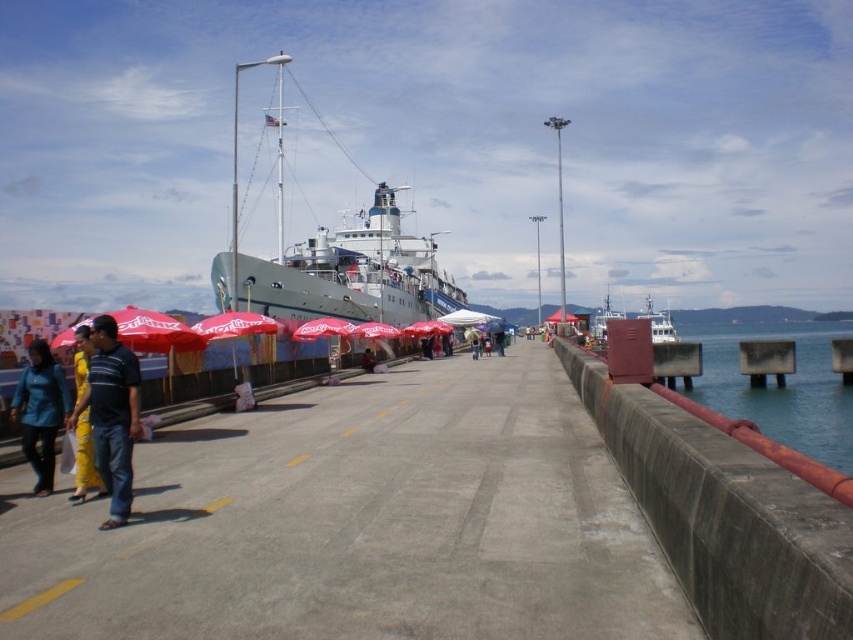
Does silver metallic ship at center have a lesser height compared to red fabric umbrella at center?

Incorrect, silver metallic ship at center's height does not fall short of red fabric umbrella at center's.

Who is more distant from viewer, [332,253] or [366,349]?

The point [332,253] is behind.

Where is `silver metallic ship at center`? This screenshot has width=853, height=640. silver metallic ship at center is located at coordinates (334, 257).

Who is more distant from viewer, (137, 392) or (363, 364)?

Point (363, 364)

Does striped fabric shirt at center appear under red fabric umbrella at center?

No, striped fabric shirt at center is not below red fabric umbrella at center.

Which is behind, point (115, 365) or point (367, 348)?

The point (367, 348) is behind.

You are a GUI agent. You are given a task and a screenshot of the screen. Output one action in this format:
    pyautogui.click(x=<x>, y=<y>)
    Task: Click on the striped fabric shirt at center
    The width and height of the screenshot is (853, 640).
    Given the screenshot: What is the action you would take?
    pyautogui.click(x=111, y=413)

Is silver metallic ship at center above matte black shirt at left?

Yes.

How distant is silver metallic ship at center from matte black shirt at left?

216.79 feet

Is point (302, 296) in front of point (91, 445)?

That is False.

Where is `silver metallic ship at center`? silver metallic ship at center is located at coordinates (334, 257).